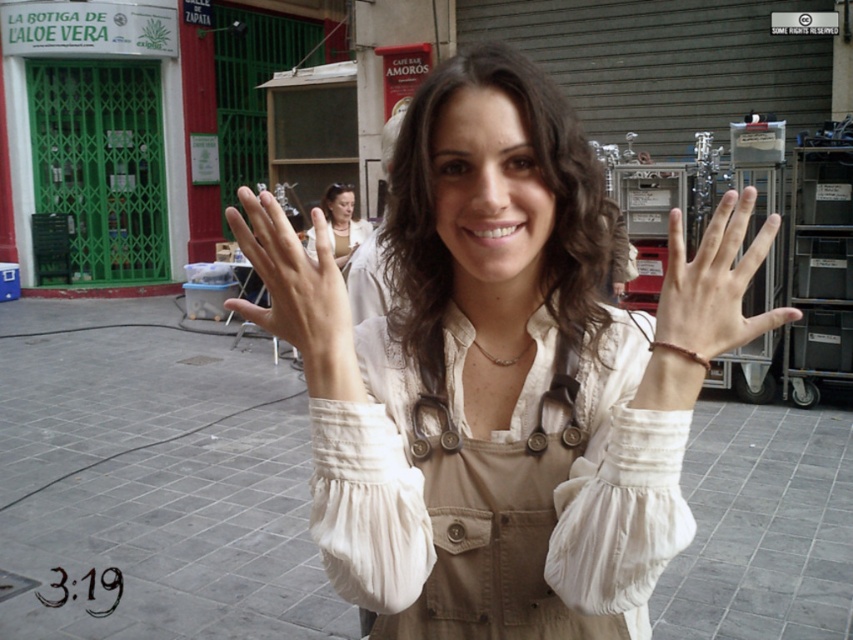
You are standing at the point with coordinates point [306,244] and want to walk to the point with coordinates point [428,422]. Which direction should you move to reach your destination?

You should move forward because point [428,422] is in front of point [306,244].

You are a photographer trying to capture the woman in the scene. You notice the beige cotton jumpsuit at center and the smooth skin hand at center. Which object is positioned closer to the camera?

The beige cotton jumpsuit at center is closer to the viewer than the smooth skin hand at center, so the beige cotton jumpsuit at center is positioned closer to the camera.

You are a photographer trying to capture the woman in the scene. The camera is set to focus on the white cotton shirt at center. Will the woman be in focus?

The white cotton shirt at center is positioned at point (500, 374), which is likely close enough to the woman to ensure she is in focus.